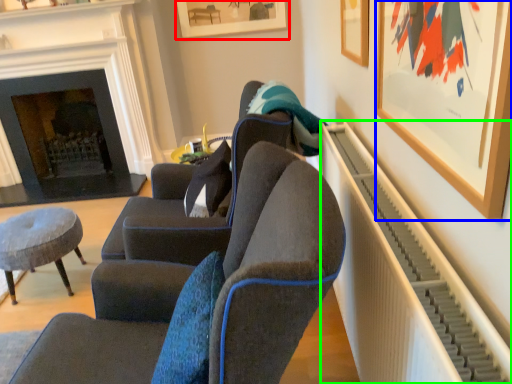
Question: Which object is positioned farthest from picture frame (highlighted by a red box)? Select from picture frame (highlighted by a blue box) and radiator (highlighted by a green box).

Choices:
 (A) picture frame
 (B) radiator

Answer: (A)